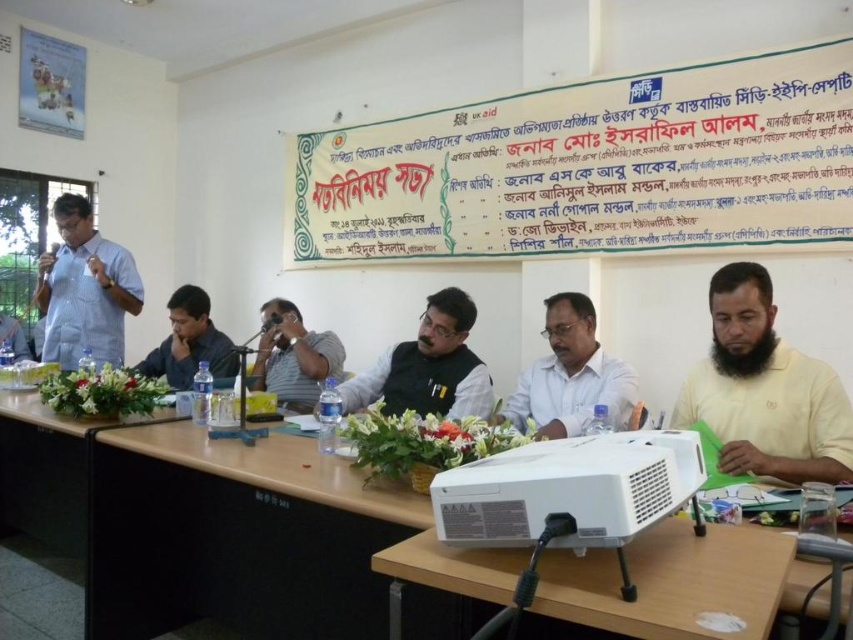
Question: Considering the real-world distances, which object is farthest from the white glossy shirt at center?

Choices:
 (A) white plastic projector at lower center
 (B) dark gray shirt at center
 (C) yellow cotton shirt at right
 (D) dark green fabric vest at center

Answer: (B)

Question: Which point appears closest to the camera in this image?

Choices:
 (A) (346, 397)
 (B) (265, 362)

Answer: (A)

Question: Does white checkered shirt at left have a smaller size compared to dark green fabric vest at center?

Choices:
 (A) yes
 (B) no

Answer: (B)

Question: Estimate the real-world distances between objects in this image. Which object is closer to the white glossy shirt at center?

Choices:
 (A) yellow cotton shirt at right
 (B) gray fabric shirt at center
 (C) white plastic projector at lower center

Answer: (A)

Question: Does white plastic projector at lower center appear on the right side of white checkered shirt at left?

Choices:
 (A) yes
 (B) no

Answer: (A)

Question: Can you confirm if gray fabric shirt at center is positioned to the left of dark gray shirt at center?

Choices:
 (A) no
 (B) yes

Answer: (A)